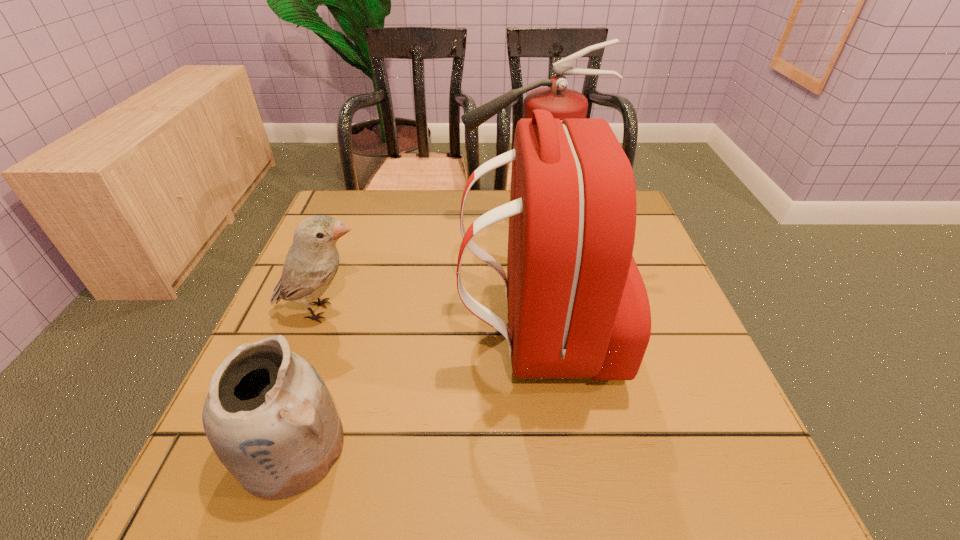
Where is `free space at the far edge`? free space at the far edge is located at coordinates (491, 193).

This screenshot has width=960, height=540. I want to click on free space at the near edge of the desktop, so click(x=640, y=503).

Where is `vacant space at the right edge of the desktop`? vacant space at the right edge of the desktop is located at coordinates (647, 268).

Where is `vacant space at the near right corner`? vacant space at the near right corner is located at coordinates (661, 487).

Where is `free space that is in between the backpack and the bird`? Image resolution: width=960 pixels, height=540 pixels. free space that is in between the backpack and the bird is located at coordinates (430, 322).

At what (x,y) coordinates should I click in order to perform the action: click on vacant space that's between the backpack and the bird. Please return your answer as a coordinate pair (x, y). This screenshot has height=540, width=960. Looking at the image, I should click on [x=430, y=322].

What are the coordinates of `vacant space in between the backpack and the pottery` in the screenshot? It's located at (414, 391).

Identify which object is located as the second nearest to the farthest object. Please provide its 2D coordinates. Your answer should be formatted as a tuple, i.e. [(x, y)], where the tuple contains the x and y coordinates of a point satisfying the conditions above.

[(312, 261)]

Where is `object that is the third closest to the pottery`? object that is the third closest to the pottery is located at coordinates (563, 103).

Find the location of `free space in the image that satisfies the following two spatial constraints: 1. at the face of the bird; 2. on the right side of the pottery`. free space in the image that satisfies the following two spatial constraints: 1. at the face of the bird; 2. on the right side of the pottery is located at coordinates (271, 449).